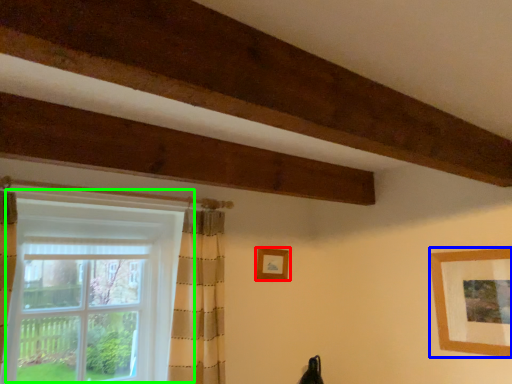
Question: Based on their relative distances, which object is nearer to picture frame (highlighted by a red box)? Choose from picture frame (highlighted by a blue box) and window (highlighted by a green box).

Choices:
 (A) picture frame
 (B) window

Answer: (B)